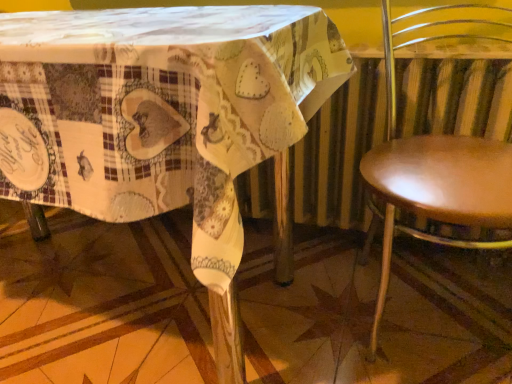
Question: Would you say shiny brown seat at right is to the left or to the right of printed fabric table at center in the picture?

Choices:
 (A) right
 (B) left

Answer: (A)

Question: Do you think shiny brown seat at right is within printed fabric table at center, or outside of it?

Choices:
 (A) outside
 (B) inside

Answer: (A)

Question: Looking at the image, does shiny brown seat at right seem bigger or smaller compared to printed fabric table at center?

Choices:
 (A) big
 (B) small

Answer: (B)

Question: Is point (55, 94) positioned closer to the camera than point (394, 46)?

Choices:
 (A) farther
 (B) closer

Answer: (B)

Question: From a real-world perspective, is printed fabric table at center positioned above or below shiny brown seat at right?

Choices:
 (A) above
 (B) below

Answer: (A)

Question: From the image's perspective, is printed fabric table at center above or below shiny brown seat at right?

Choices:
 (A) above
 (B) below

Answer: (A)

Question: Is printed fabric table at center in front of or behind shiny brown seat at right in the image?

Choices:
 (A) front
 (B) behind

Answer: (A)